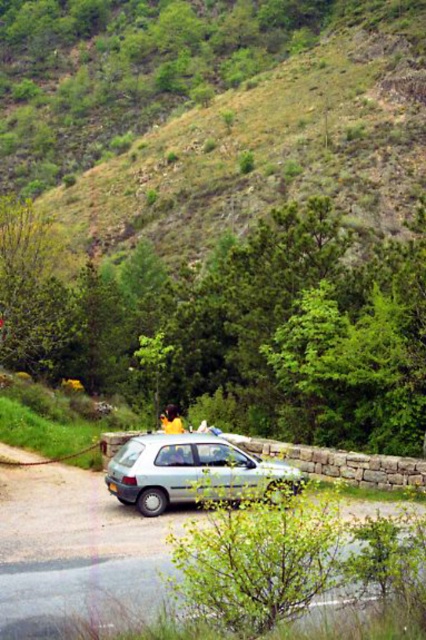
Does point (77, 579) lie in front of point (161, 426)?

Yes, it is.

Does metallic silver car at center appear on the left side of yellow fabric at center?

In fact, metallic silver car at center is to the right of yellow fabric at center.

This screenshot has height=640, width=426. Find the location of `metallic silver car at center`. metallic silver car at center is located at coordinates (75, 552).

The width and height of the screenshot is (426, 640). What do you see at coordinates (75, 552) in the screenshot?
I see `metallic silver car at center` at bounding box center [75, 552].

Is metallic silver car at center shorter than light blue metallic hatchback at center?

Indeed, metallic silver car at center has a lesser height compared to light blue metallic hatchback at center.

Which is behind, point (20, 467) or point (199, 452)?

Positioned behind is point (20, 467).

Identify the location of metallic silver car at center. (75, 552).

Can you confirm if green grassy hillside at upper center is positioned to the left of metallic silver car at center?

Indeed, green grassy hillside at upper center is positioned on the left side of metallic silver car at center.

Is point (40, 122) positioned after point (408, 506)?

Yes, point (40, 122) is behind point (408, 506).

Locate an element on the screen. The image size is (426, 640). green grassy hillside at upper center is located at coordinates (224, 124).